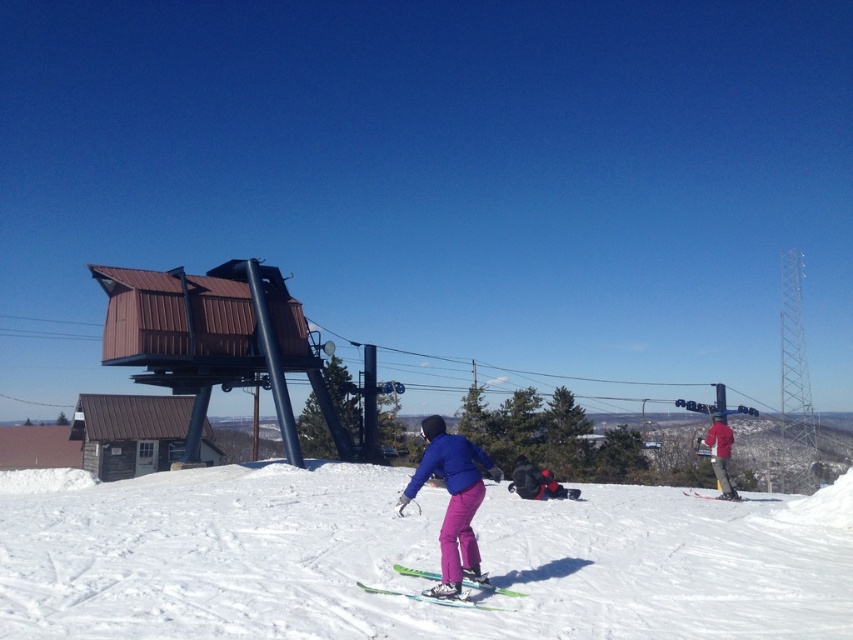
Question: Estimate the real-world distances between objects in this image. Which object is farther from the red fabric jacket at right?

Choices:
 (A) green plastic ski at center
 (B) white powdery snow at center
 (C) matte blue jacket at center

Answer: (C)

Question: Which object is the farthest from the matte blue jacket at center?

Choices:
 (A) green plastic ski at center
 (B) matte black ski at right
 (C) red fabric jacket at right
 (D) white powdery snow at center

Answer: (C)

Question: Does white powdery snow at center appear under red fabric jacket at right?

Choices:
 (A) no
 (B) yes

Answer: (A)

Question: Can you confirm if white powdery snow at center is positioned above matte black ski at right?

Choices:
 (A) yes
 (B) no

Answer: (A)

Question: Which object is closer to the camera taking this photo?

Choices:
 (A) white powdery snow at center
 (B) matte blue jacket at center

Answer: (A)

Question: From the image, what is the correct spatial relationship of matte blue jacket at center in relation to red fabric jacket at right?

Choices:
 (A) right
 (B) left

Answer: (B)